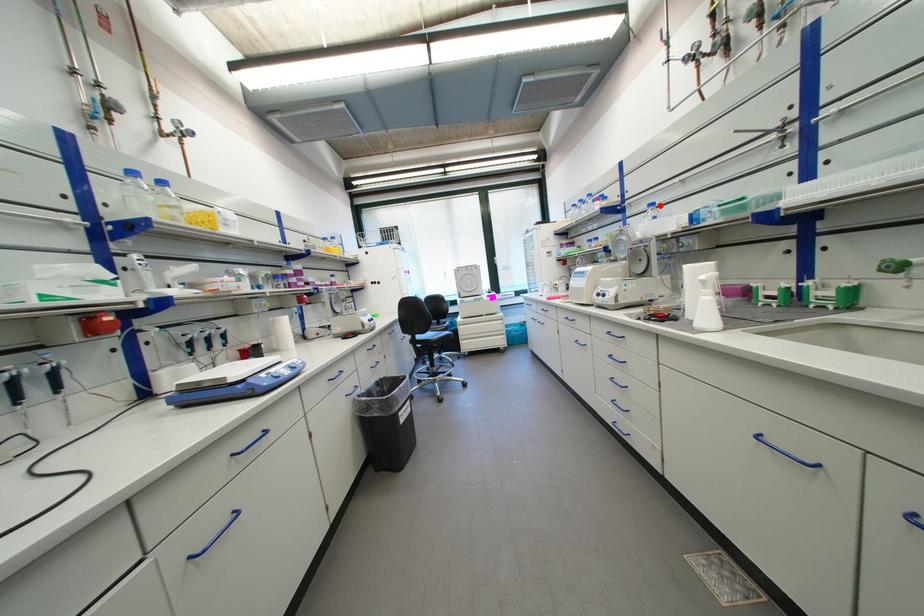
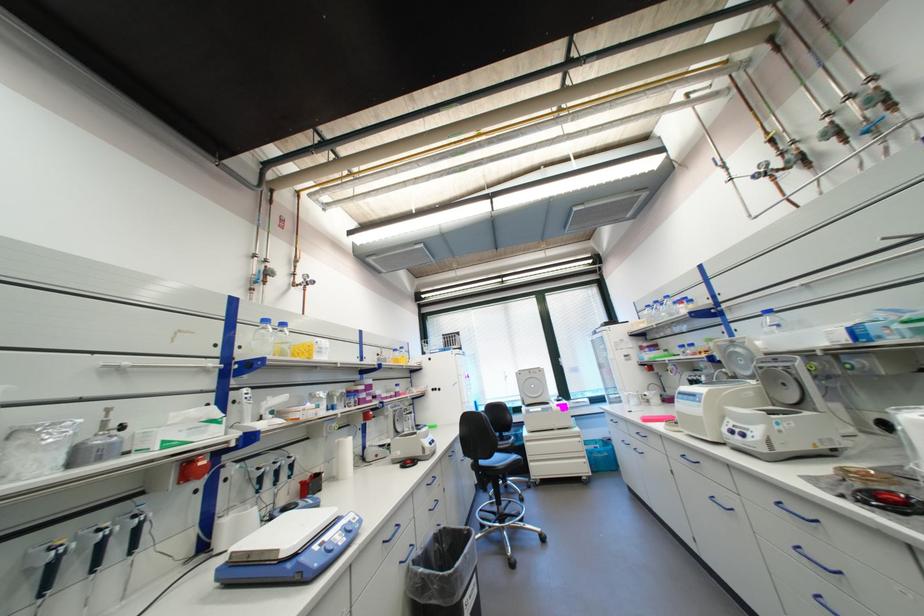
Where in the second image is the point corresponding to the highlighted location from the first image?

(776, 312)